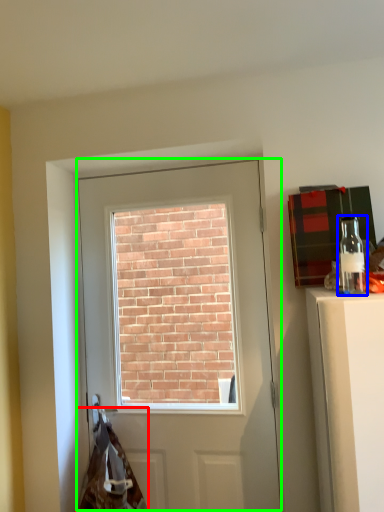
Question: Based on their relative distances, which object is farther from material (highlighted by a red box)? Choose from bottle (highlighted by a blue box) and door (highlighted by a green box).

Choices:
 (A) bottle
 (B) door

Answer: (A)